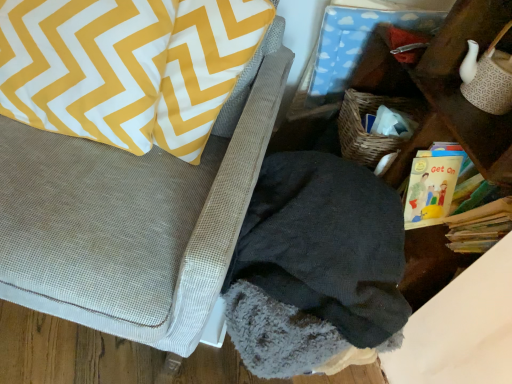
Question: Do you think yellow paper book at right is within dark fleece blanket at lower right, or outside of it?

Choices:
 (A) outside
 (B) inside

Answer: (A)

Question: From a real-world perspective, is yellow paper book at right physically located above or below dark fleece blanket at lower right?

Choices:
 (A) below
 (B) above

Answer: (B)

Question: Which object is the farthest from the dark fleece blanket at lower right?

Choices:
 (A) fuzzy gray blanket at lower right
 (B) yellow paper book at right
 (C) yellow/white zigzag pillow at upper left

Answer: (C)

Question: Estimate the real-world distances between objects in this image. Which object is closer to the fuzzy gray blanket at lower right?

Choices:
 (A) yellow/white zigzag pillow at upper left
 (B) dark fleece blanket at lower right
 (C) yellow paper book at right

Answer: (A)